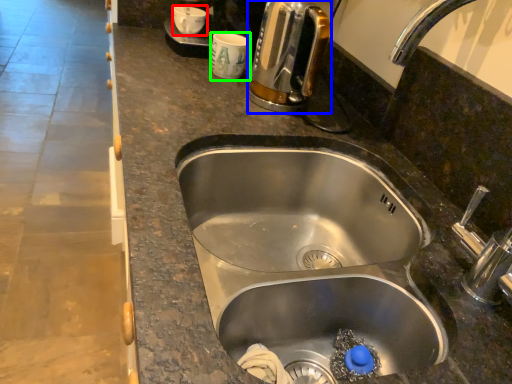
Question: Which object is positioned farthest from coffee cup (highlighted by a red box)? Select from coffee maker (highlighted by a blue box) and coffee cup (highlighted by a green box).

Choices:
 (A) coffee maker
 (B) coffee cup

Answer: (A)